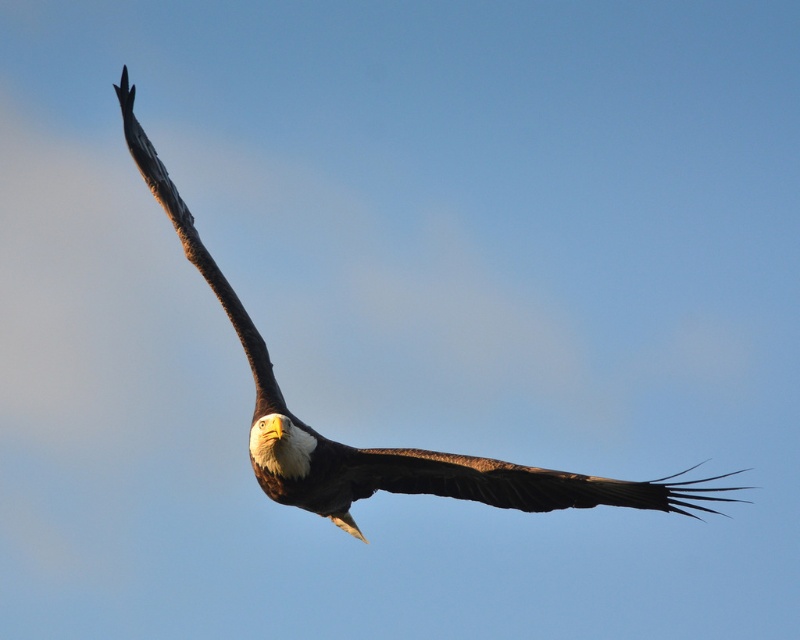
Does brown feathered eagle at upper left have a lesser height compared to brown feathered wing at upper center?

Indeed, brown feathered eagle at upper left has a lesser height compared to brown feathered wing at upper center.

Between brown feathered eagle at upper left and brown feathered wing at upper center, which one has less height?

Standing shorter between the two is brown feathered eagle at upper left.

Which is in front, point (240, 333) or point (506, 506)?

Point (506, 506)

Locate an element on the screen. This screenshot has width=800, height=640. brown feathered eagle at upper left is located at coordinates (376, 448).

Can you confirm if brown feathered eagle at upper left is positioned below brown textured wing at upper left?

Actually, brown feathered eagle at upper left is above brown textured wing at upper left.

Is point (702, 499) less distant than point (200, 268)?

That is True.

Which is behind, point (262, 376) or point (240, 317)?

Positioned behind is point (240, 317).

Where is `brown feathered eagle at upper left`? This screenshot has width=800, height=640. brown feathered eagle at upper left is located at coordinates (376, 448).

Is brown feathered wing at upper center to the right of brown textured wing at upper left from the viewer's perspective?

Correct, you'll find brown feathered wing at upper center to the right of brown textured wing at upper left.

Which is behind, point (610, 481) or point (260, 349)?

The point (260, 349) is more distant.

In order to click on brown feathered wing at upper center in this screenshot , I will do `click(522, 483)`.